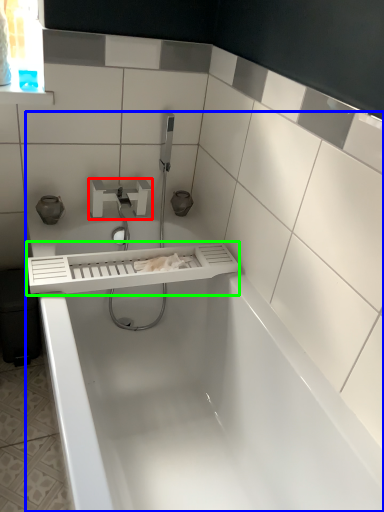
Question: Which is nearer to the tap (highlighted by a red box)? bathtub (highlighted by a blue box) or balustrade (highlighted by a green box).

Choices:
 (A) bathtub
 (B) balustrade

Answer: (B)